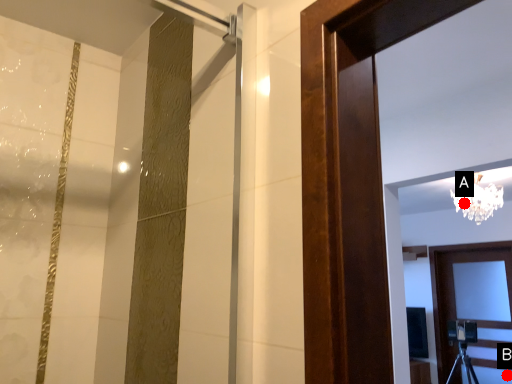
Question: Two points are circled on the image, labeled by A and B beside each circle. Which point is closer to the camera?

Choices:
 (A) A is closer
 (B) B is closer

Answer: (A)